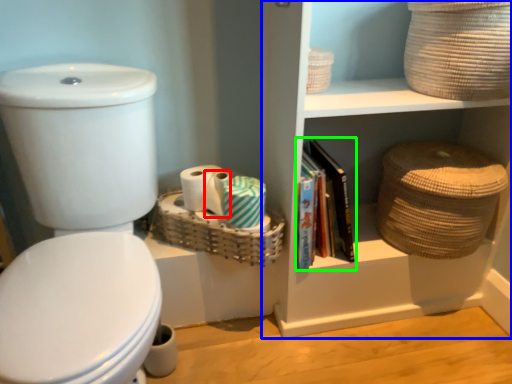
Question: Based on their relative distances, which object is nearer to toilet paper (highlighted by a red box)? Choose from cabinet (highlighted by a blue box) and magazine (highlighted by a green box).

Choices:
 (A) cabinet
 (B) magazine

Answer: (B)